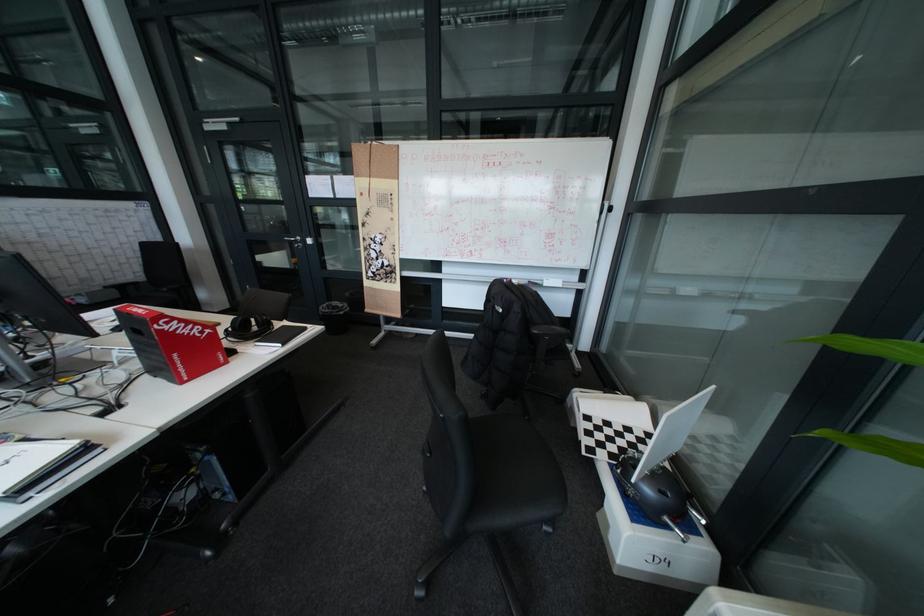
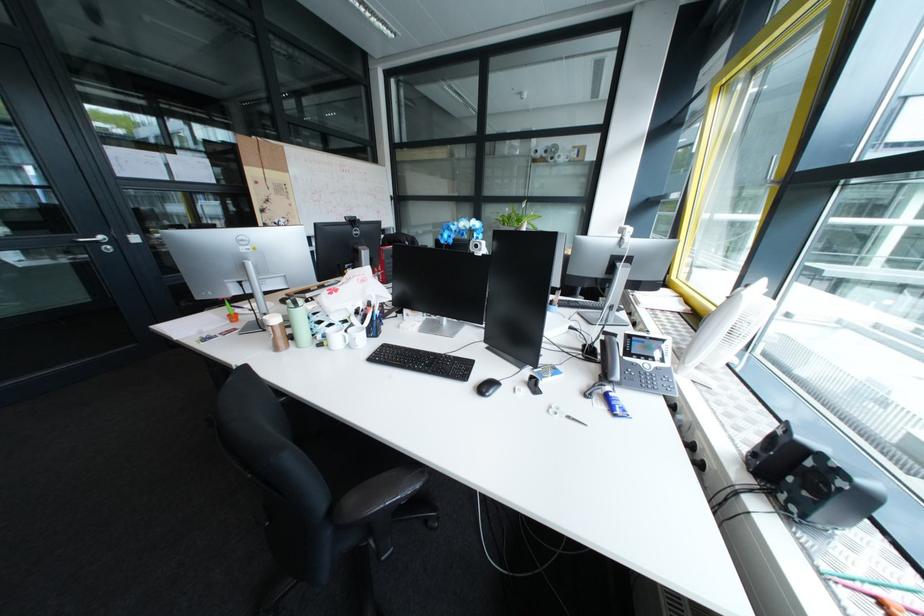
Question: I am providing you with two images of the same scene from different viewpoints. After the viewpoint changes to image2, which objects are now occluded?

Choices:
 (A) brown shaker cup
 (B) silver door handle
 (C) black chair sitting surface
 (D) grey chair armrest

Answer: (C)